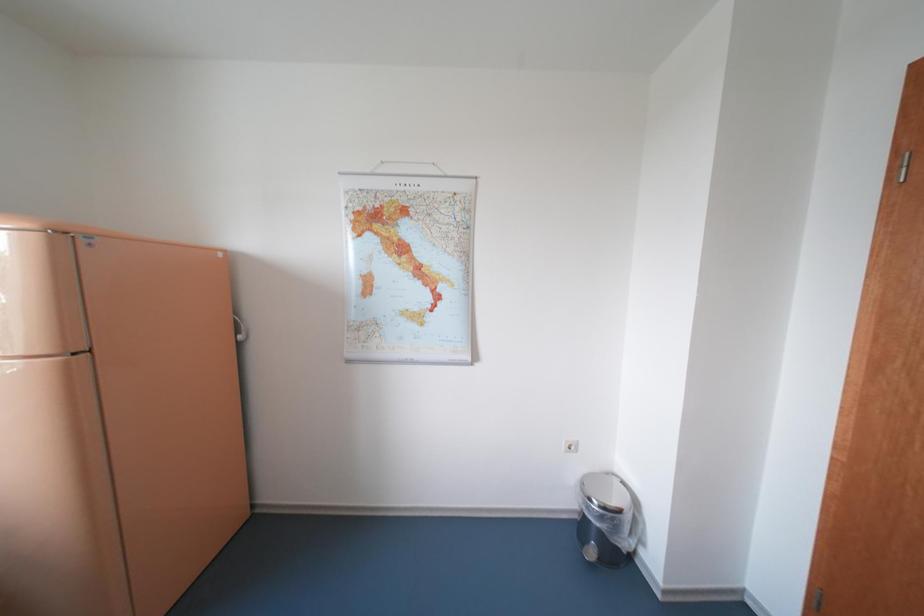
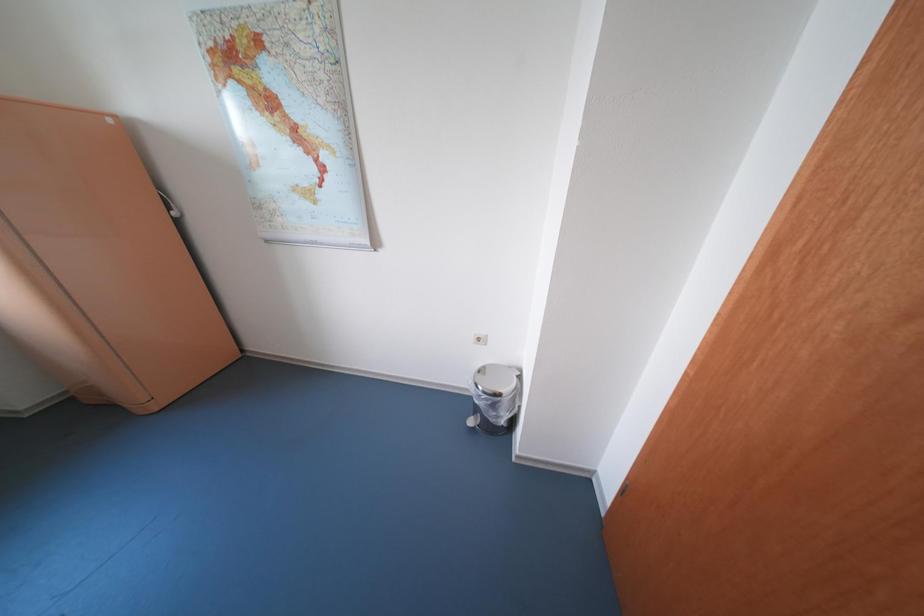
Question: Which direction would the cameraman need to move to produce the second image? Reply with the corresponding letter.

Choices:
 (A) Left
 (B) Right
 (C) Forward
 (D) Backward

Answer: (B)